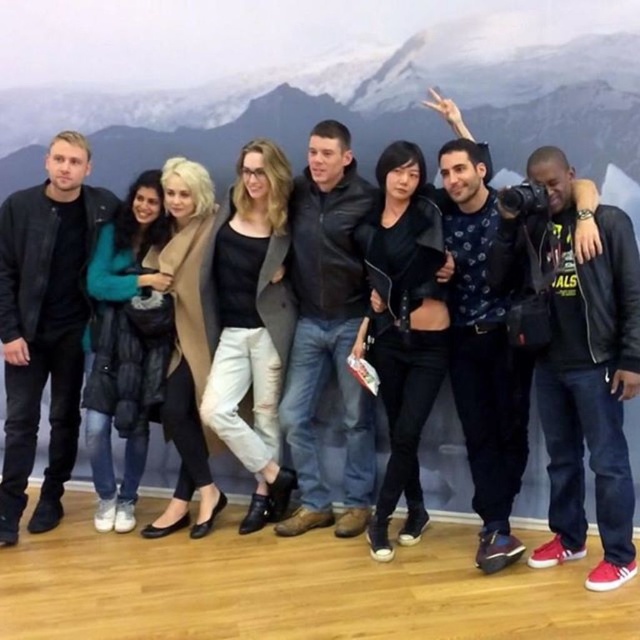
Question: Which is farther from the black leather jacket at center?

Choices:
 (A) black leather jacket at right
 (B) black leather jacket at left
 (C) snowy mountain at upper center

Answer: (B)

Question: Observing the image, what is the correct spatial positioning of black leather jacket at right in reference to black leather jacket at center?

Choices:
 (A) below
 (B) above

Answer: (A)

Question: Which object appears farthest from the camera in this image?

Choices:
 (A) black leather jacket at center
 (B) black leather jacket at right
 (C) snowy mountain at upper center
 (D) black leather jacket at left

Answer: (D)

Question: Does snowy mountain at upper center appear on the left side of black leather jacket at right?

Choices:
 (A) yes
 (B) no

Answer: (A)

Question: Is snowy mountain at upper center wider than black leather jacket at left?

Choices:
 (A) yes
 (B) no

Answer: (A)

Question: Which of the following is the closest to the observer?

Choices:
 (A) black leather jacket at center
 (B) snowy mountain at upper center

Answer: (B)